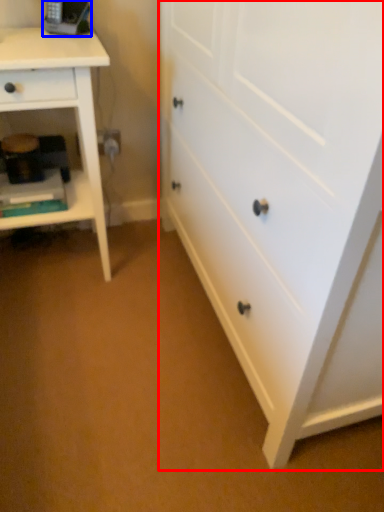
Question: Which object appears closest to the camera in this image, chest of drawers (highlighted by a red box) or equipment (highlighted by a blue box)?

Choices:
 (A) chest of drawers
 (B) equipment

Answer: (A)